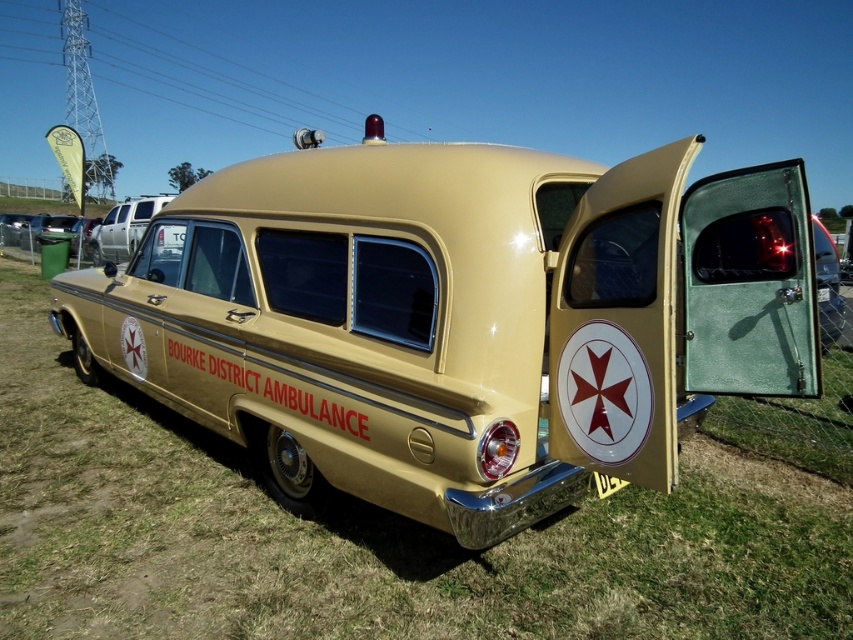
Question: Is metallic silver van at left positioned at the back of yellow plastic license plate at center?

Choices:
 (A) no
 (B) yes

Answer: (B)

Question: Which point is closer to the camera taking this photo?

Choices:
 (A) (119, 205)
 (B) (833, 296)
 (C) (601, 474)
 (D) (273, 356)

Answer: (C)

Question: Can you confirm if gold metallic ambulance at center is positioned to the right of metallic silver van at left?

Choices:
 (A) yes
 (B) no

Answer: (A)

Question: Which point is closer to the camera?

Choices:
 (A) gold metallic license plate at center
 (B) yellow plastic license plate at center
 (C) gold metallic ambulance at center
 (D) metallic silver van at left

Answer: (C)

Question: Is gold metallic ambulance at center closer to camera compared to metallic silver van at left?

Choices:
 (A) yes
 (B) no

Answer: (A)

Question: Which point is farther from the camera taking this photo?

Choices:
 (A) (537, 172)
 (B) (618, 483)
 (C) (817, 289)
 (D) (125, 221)

Answer: (D)